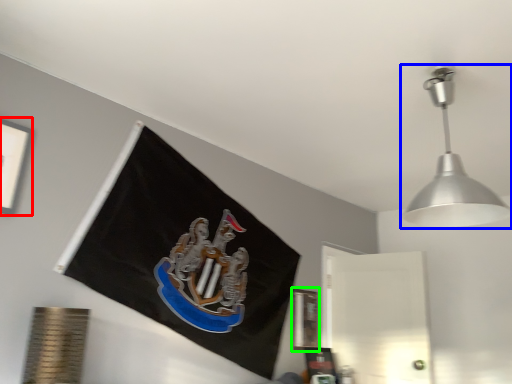
Question: Which object is the farthest from picture frame (highlighted by a red box)? Choose among these: lamp (highlighted by a blue box) or picture frame (highlighted by a green box).

Choices:
 (A) lamp
 (B) picture frame

Answer: (B)